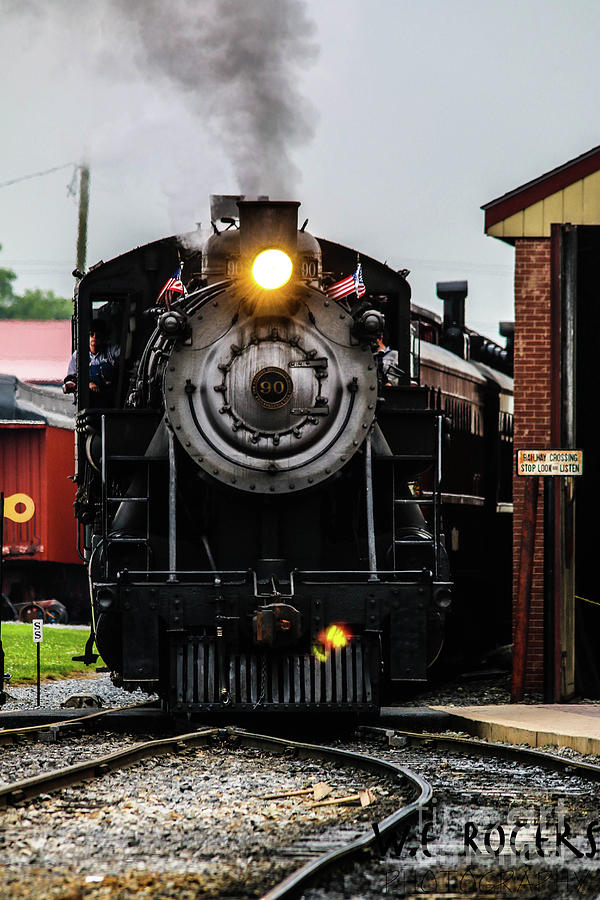
Image resolution: width=600 pixels, height=900 pixels. What are the coordinates of `footboards` in the screenshot? It's located at (140, 678), (405, 678).